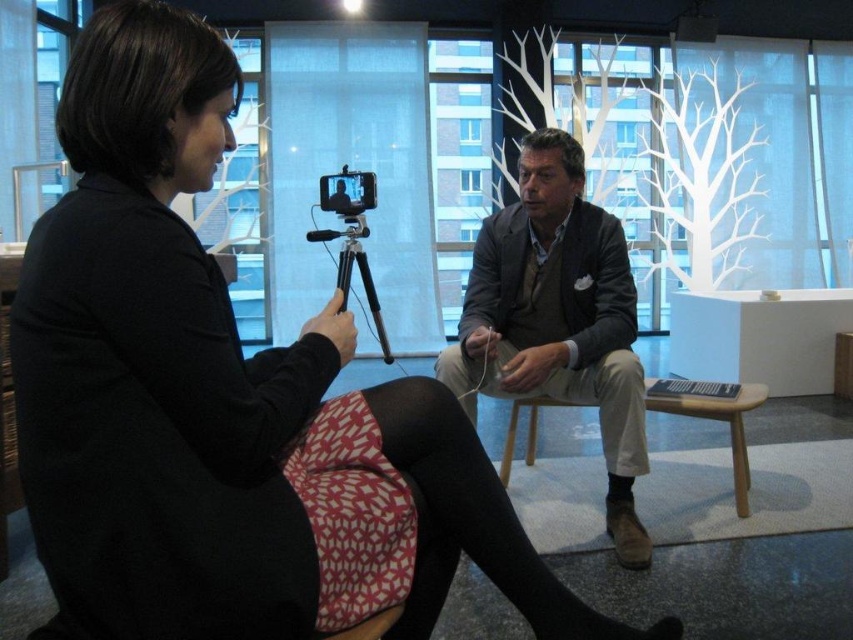
Question: Is the position of dark brown leather jacket at center less distant than that of matte black tripod-mounted camera at center?

Choices:
 (A) no
 (B) yes

Answer: (B)

Question: Is black plastic tripod at center positioned before matte black tripod-mounted camera at center?

Choices:
 (A) no
 (B) yes

Answer: (B)

Question: Which of the following is the farthest from the observer?

Choices:
 (A) (554, 148)
 (B) (329, 189)

Answer: (B)

Question: Among these points, which one is nearest to the camera?

Choices:
 (A) (338, 230)
 (B) (328, 200)
 (C) (579, 296)

Answer: (C)

Question: Does dark brown leather jacket at center appear on the left side of matte black tripod-mounted camera at center?

Choices:
 (A) yes
 (B) no

Answer: (B)

Question: Among these points, which one is nearest to the camera?

Choices:
 (A) (352, 198)
 (B) (341, 232)
 (C) (619, 301)

Answer: (C)